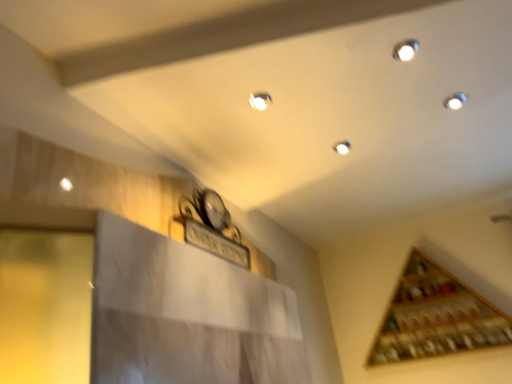
Question: From a real-world perspective, does matte white light at upper center stand above wooden wine rack at upper right?

Choices:
 (A) no
 (B) yes

Answer: (B)

Question: Does matte white light at upper center turn towards wooden wine rack at upper right?

Choices:
 (A) no
 (B) yes

Answer: (A)

Question: Is matte white light at upper center turned away from wooden wine rack at upper right?

Choices:
 (A) yes
 (B) no

Answer: (B)

Question: Is matte white light at upper center further to the viewer compared to wooden wine rack at upper right?

Choices:
 (A) yes
 (B) no

Answer: (B)

Question: Does matte white light at upper center have a lesser width compared to wooden wine rack at upper right?

Choices:
 (A) yes
 (B) no

Answer: (A)

Question: Considering the relative sizes of matte white light at upper center and wooden wine rack at upper right in the image provided, is matte white light at upper center smaller than wooden wine rack at upper right?

Choices:
 (A) yes
 (B) no

Answer: (A)

Question: Is wooden wine rack at upper right shorter than matte white light at upper center?

Choices:
 (A) no
 (B) yes

Answer: (A)

Question: Is wooden wine rack at upper right closer to camera compared to matte white light at upper center?

Choices:
 (A) yes
 (B) no

Answer: (B)

Question: Is wooden wine rack at upper right positioned with its back to matte white light at upper center?

Choices:
 (A) yes
 (B) no

Answer: (B)

Question: Would you say wooden wine rack at upper right contains matte white light at upper center?

Choices:
 (A) no
 (B) yes

Answer: (A)

Question: Is wooden wine rack at upper right oriented towards matte white light at upper center?

Choices:
 (A) yes
 (B) no

Answer: (A)

Question: Is the depth of wooden wine rack at upper right greater than that of matte white light at upper center?

Choices:
 (A) yes
 (B) no

Answer: (A)

Question: In the image, is wooden wine rack at upper right positioned in front of or behind matte white light at upper center?

Choices:
 (A) behind
 (B) front

Answer: (A)